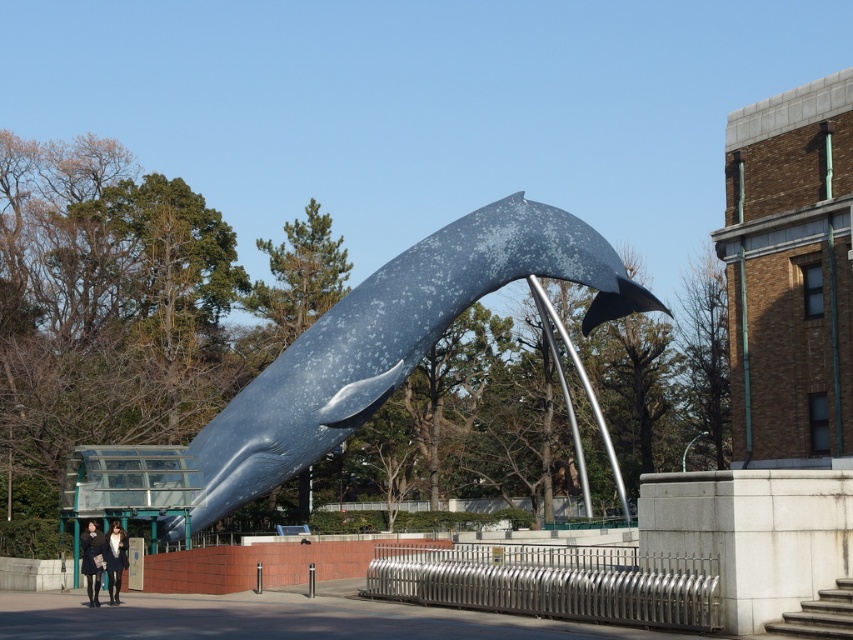
Is speckled blue whale at center to the left of matte black coat at lower left from the viewer's perspective?

In fact, speckled blue whale at center is to the right of matte black coat at lower left.

Find the location of a particular element. The width and height of the screenshot is (853, 640). speckled blue whale at center is located at coordinates (393, 340).

The height and width of the screenshot is (640, 853). Describe the element at coordinates (393, 340) in the screenshot. I see `speckled blue whale at center` at that location.

Locate an element on the screen. This screenshot has height=640, width=853. speckled blue whale at center is located at coordinates point(393,340).

Who is positioned more to the left, black wool coat at lower left or matte black coat at lower left?

black wool coat at lower left is more to the left.

Which is below, black wool coat at lower left or matte black coat at lower left?

black wool coat at lower left is lower down.

This screenshot has width=853, height=640. What do you see at coordinates (91, 560) in the screenshot? I see `black wool coat at lower left` at bounding box center [91, 560].

Identify the location of black wool coat at lower left. The width and height of the screenshot is (853, 640). (91, 560).

Which is above, speckled blue whale at center or black wool coat at lower left?

speckled blue whale at center is above.

This screenshot has height=640, width=853. I want to click on speckled blue whale at center, so click(x=393, y=340).

You are a GUI agent. You are given a task and a screenshot of the screen. Output one action in this format:
    pyautogui.click(x=<x>, y=<y>)
    Task: Click on the speckled blue whale at center
    
    Given the screenshot: What is the action you would take?
    pyautogui.click(x=393, y=340)